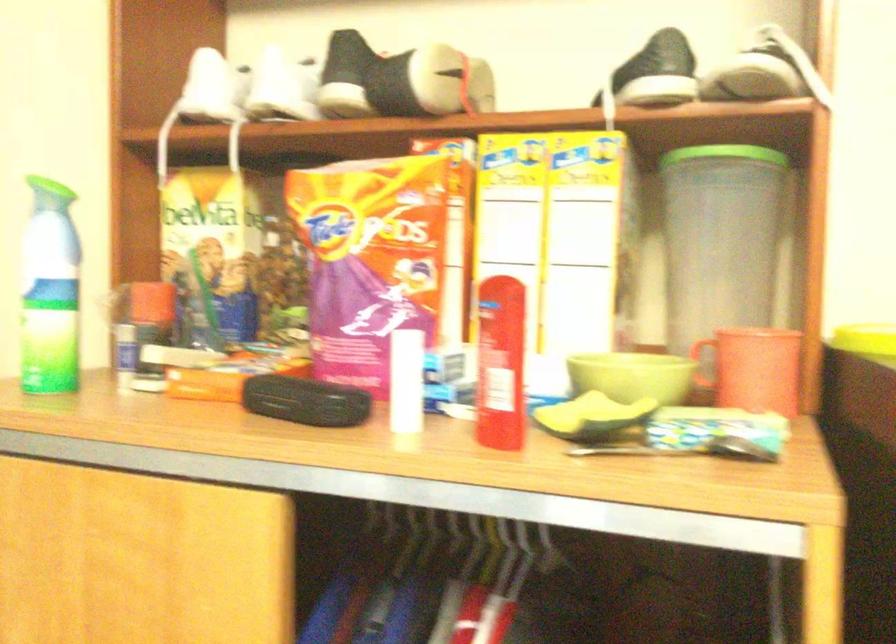
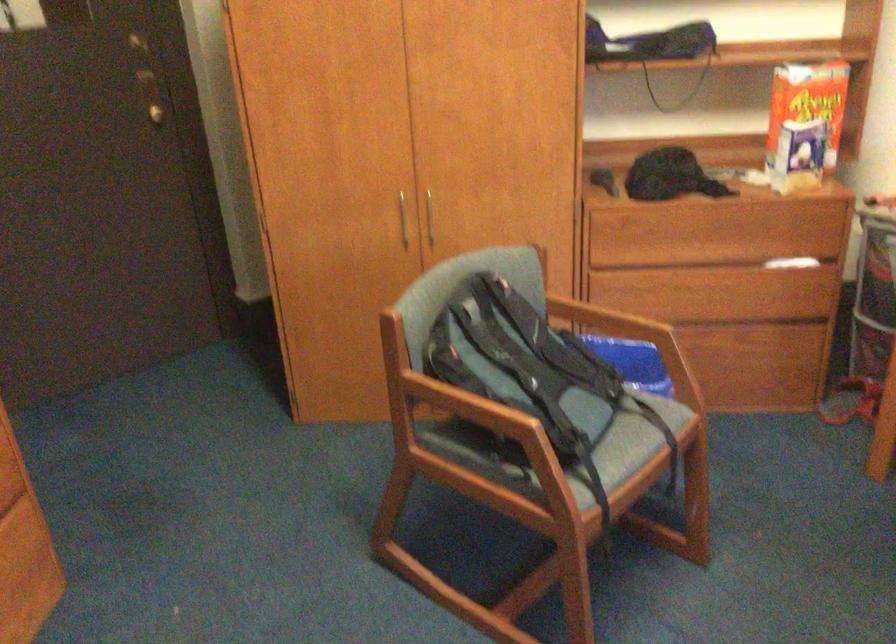
The first image is from the beginning of the video and the second image is from the end. How did the camera likely rotate when shooting the video?

The camera rotated toward right-down.